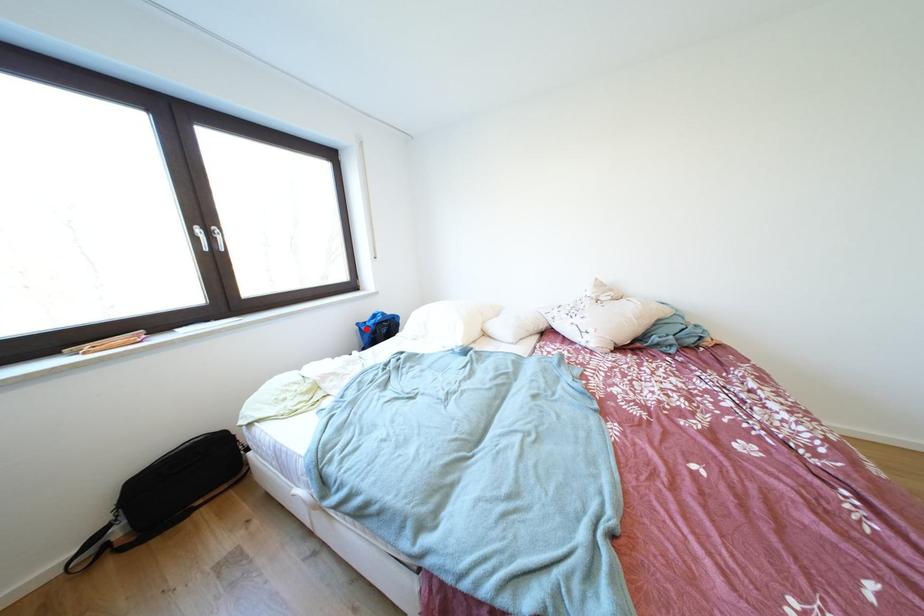
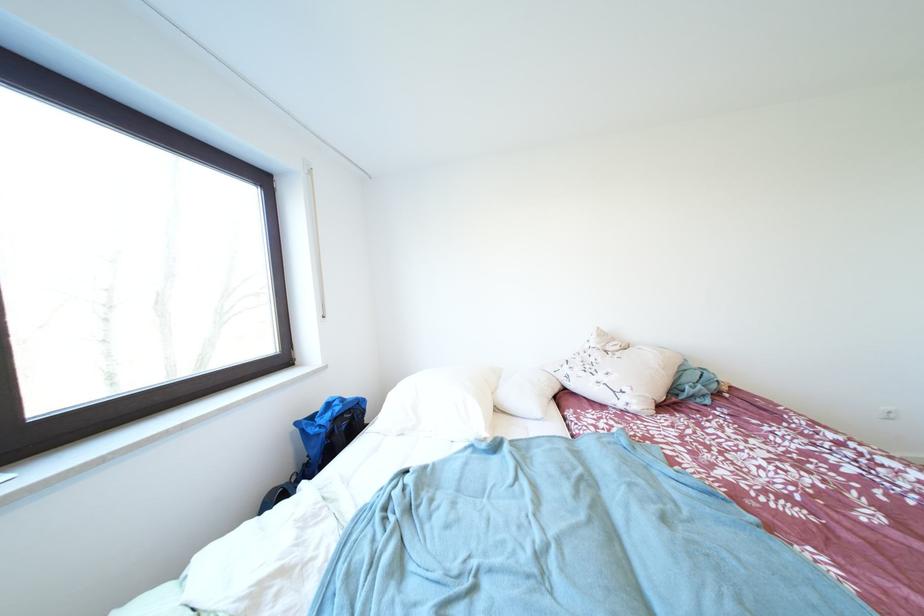
Question: I am providing you with two images of the same scene from different viewpoints. Given a red point in image1, look at the same physical point in image2. Is it:

Choices:
 (A) Closer to the viewpoint
 (B) Farther from the viewpoint

Answer: (B)